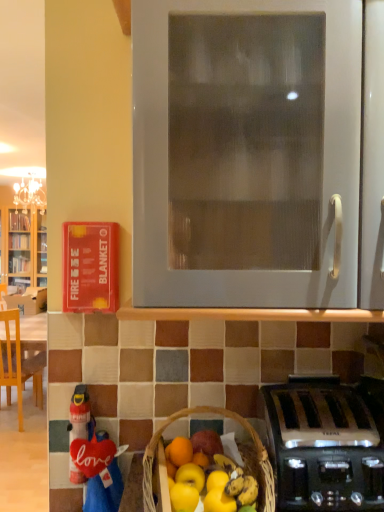
Question: From the image's perspective, is white matte oven at center positioned above or below wooden chair at left?

Choices:
 (A) below
 (B) above

Answer: (B)

Question: Is white matte oven at center bigger or smaller than wooden chair at left?

Choices:
 (A) big
 (B) small

Answer: (B)

Question: Estimate the real-world distances between objects in this image. Which object is farther from the satin silver toaster at lower right?

Choices:
 (A) red fabric love sign at lower left
 (B) wooden chair at left
 (C) brown wicker basket at lower center
 (D) white matte oven at center

Answer: (B)

Question: Which of these objects is positioned farthest from the satin silver toaster at lower right?

Choices:
 (A) wooden chair at left
 (B) white matte oven at center
 (C) brown wicker basket at lower center
 (D) red fabric love sign at lower left

Answer: (A)